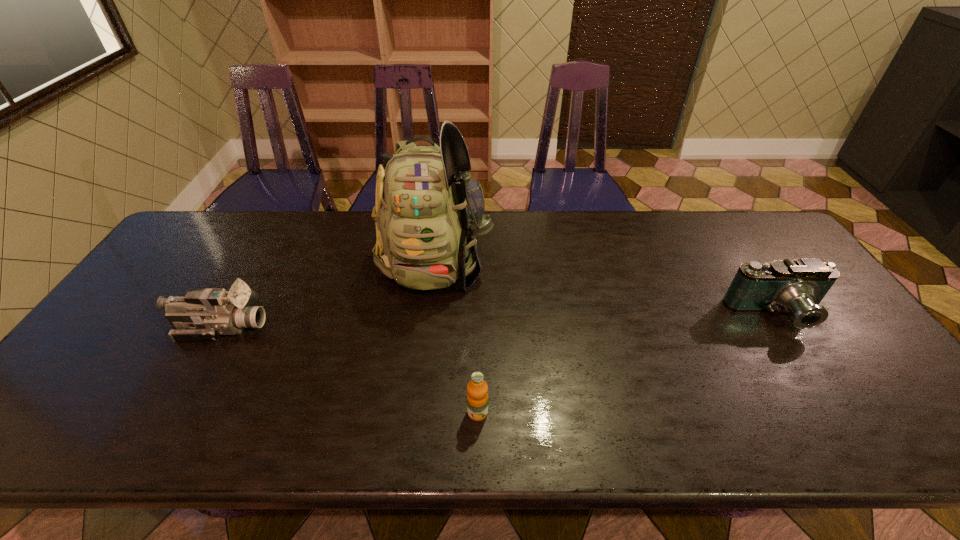
Identify the location of backpack. This screenshot has height=540, width=960. (428, 212).

This screenshot has height=540, width=960. I want to click on the leftmost object, so click(202, 315).

Locate an element on the screen. the right camcorder is located at coordinates (797, 286).

What are the coordinates of `the nearest object` in the screenshot? It's located at (477, 389).

Where is `free space located on the front-facing side of the tallest object`? The width and height of the screenshot is (960, 540). free space located on the front-facing side of the tallest object is located at coordinates (420, 395).

In order to click on free point located 0.270m on the front-facing side of the leftmost object in this screenshot , I will do `click(368, 327)`.

At what (x,y) coordinates should I click in order to perform the action: click on vacant position located on the front-facing side of the rightmost object. Please return your answer as a coordinate pair (x, y). Looking at the image, I should click on (817, 380).

The height and width of the screenshot is (540, 960). Find the location of `object at the far edge`. object at the far edge is located at coordinates (428, 212).

The image size is (960, 540). I want to click on object at the near edge, so 477,389.

The image size is (960, 540). Find the location of `object located in the right edge section of the desktop`. object located in the right edge section of the desktop is located at coordinates (797, 286).